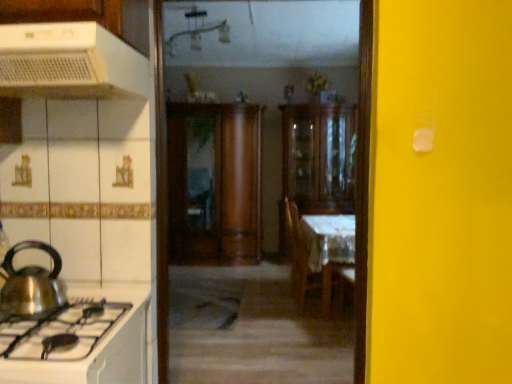
Question: From a real-world perspective, is shiny metallic kettle at left, marked as the second kitchen appliance in a top-to-bottom arrangement, physically below wooden chair at center?

Choices:
 (A) no
 (B) yes

Answer: (A)

Question: Is shiny metallic kettle at left, marked as the second kitchen appliance in a top-to-bottom arrangement, aimed at wooden chair at center?

Choices:
 (A) no
 (B) yes

Answer: (A)

Question: Can you confirm if shiny metallic kettle at left, marked as the second kitchen appliance in a top-to-bottom arrangement, is smaller than wooden chair at center?

Choices:
 (A) no
 (B) yes

Answer: (B)

Question: Does shiny metallic kettle at left, marked as the second kitchen appliance in a top-to-bottom arrangement, have a greater height compared to wooden chair at center?

Choices:
 (A) yes
 (B) no

Answer: (B)

Question: Is white plastic range hood at upper left, marked as the first kitchen appliance in a top-to-bottom arrangement, inside the boundaries of wooden cabinet at center, the second cabinetry in the right-to-left sequence, or outside?

Choices:
 (A) outside
 (B) inside

Answer: (A)

Question: In terms of size, does white plastic range hood at upper left, marked as the first kitchen appliance in a top-to-bottom arrangement, appear bigger or smaller than wooden cabinet at center, the second cabinetry in the right-to-left sequence?

Choices:
 (A) small
 (B) big

Answer: (A)

Question: Looking at their shapes, would you say white plastic range hood at upper left, marked as the first kitchen appliance in a top-to-bottom arrangement, is wider or thinner than wooden cabinet at center, the second cabinetry in the right-to-left sequence?

Choices:
 (A) wide
 (B) thin

Answer: (A)

Question: Considering their positions, is white plastic range hood at upper left, marked as the first kitchen appliance in a top-to-bottom arrangement, located in front of or behind wooden cabinet at center, the first cabinetry in the left-to-right sequence?

Choices:
 (A) behind
 (B) front

Answer: (B)

Question: Is shiny metallic kettle at left, marked as the second kitchen appliance in a top-to-bottom arrangement, taller or shorter than white glossy stove at lower left?

Choices:
 (A) tall
 (B) short

Answer: (A)

Question: Looking at their shapes, would you say shiny metallic kettle at left, marked as the second kitchen appliance in a top-to-bottom arrangement, is wider or thinner than white glossy stove at lower left?

Choices:
 (A) wide
 (B) thin

Answer: (B)

Question: From the image's perspective, is shiny metallic kettle at left, the first kitchen appliance when ordered from bottom to top, above or below white glossy stove at lower left?

Choices:
 (A) below
 (B) above

Answer: (B)

Question: Is point (35, 266) closer or farther from the camera than point (66, 367)?

Choices:
 (A) farther
 (B) closer

Answer: (A)

Question: Is white plastic range hood at upper left, the 2th kitchen appliance positioned from the bottom, in front of or behind white glossy stove at lower left in the image?

Choices:
 (A) front
 (B) behind

Answer: (B)

Question: Does point (2, 39) appear closer or farther from the camera than point (104, 292)?

Choices:
 (A) closer
 (B) farther

Answer: (A)